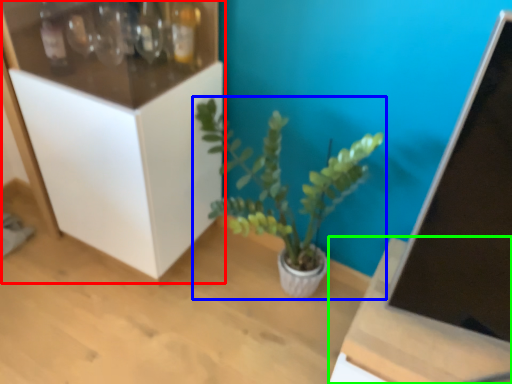
Question: Considering the real-world distances, which object is closest to cabinetry (highlighted by a red box)? houseplant (highlighted by a blue box) or table (highlighted by a green box).

Choices:
 (A) houseplant
 (B) table

Answer: (A)